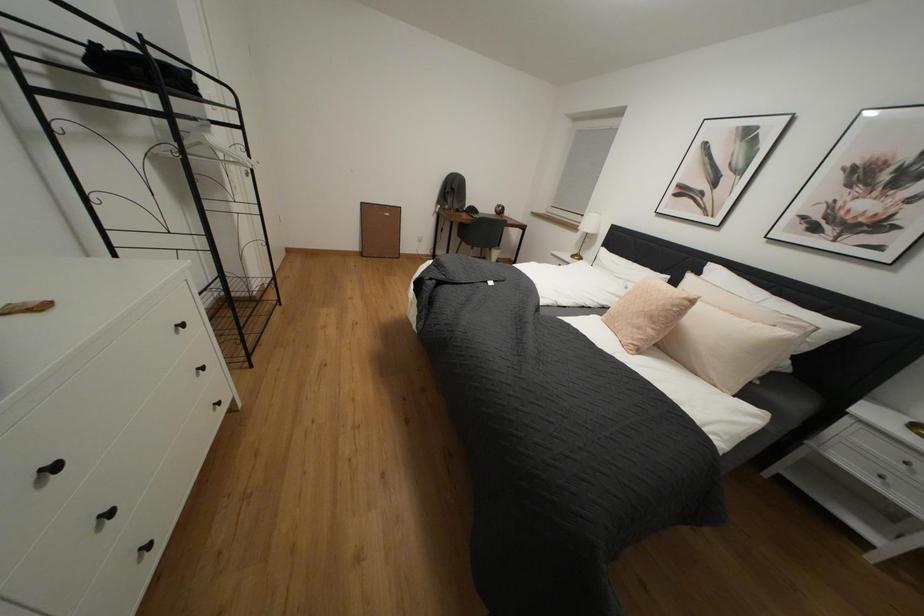
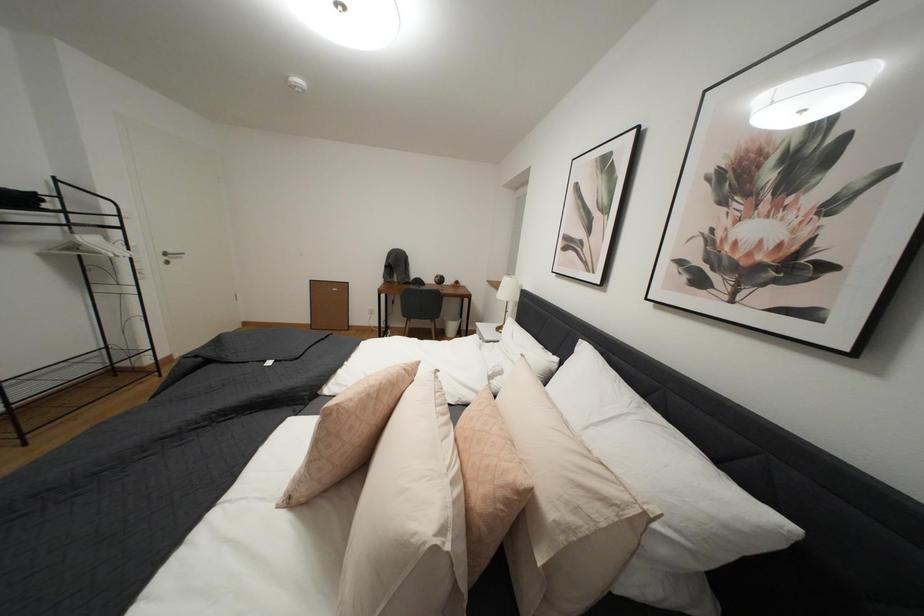
Which direction would the cameraman need to move to produce the second image?

The cameraman walked toward right, forward.